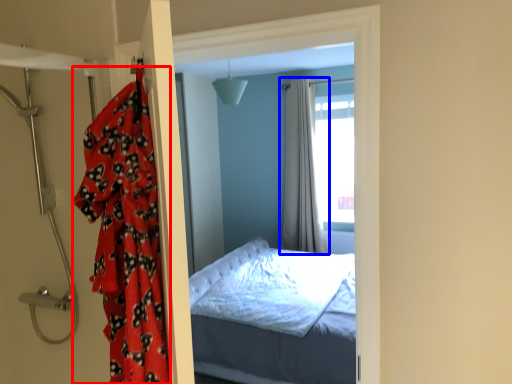
Question: Which object appears closest to the camera in this image, blanket (highlighted by a red box) or curtain (highlighted by a blue box)?

Choices:
 (A) blanket
 (B) curtain

Answer: (A)